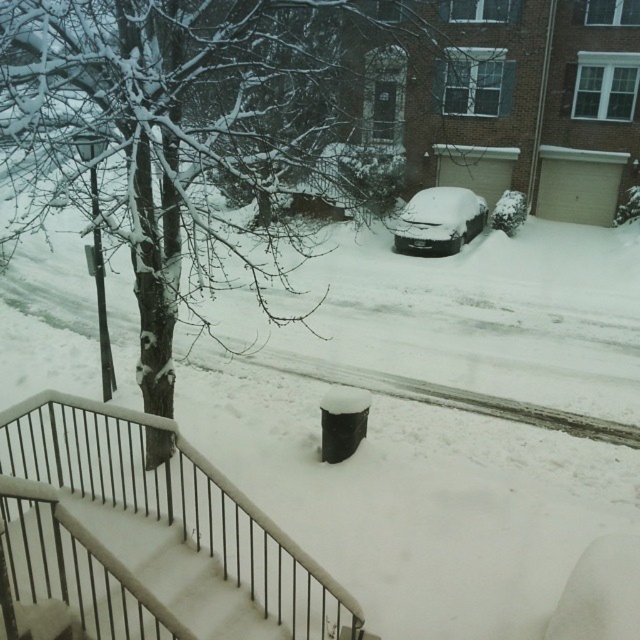
Who is shorter, snow-covered tree at center or snow-covered car at center?

snow-covered car at center

From the picture: Can you confirm if snow-covered tree at center is thinner than snow-covered car at center?

Incorrect, snow-covered tree at center's width is not less than snow-covered car at center's.

This screenshot has width=640, height=640. I want to click on snow-covered tree at center, so click(x=168, y=136).

This screenshot has width=640, height=640. What are the coordinates of `snow-covered tree at center` in the screenshot? It's located at (168, 136).

Is point (305, 45) closer to viewer compared to point (106, 593)?

No, it is not.

Who is lower down, snow-covered tree at center or metallic gray balustrade at lower center?

Positioned lower is metallic gray balustrade at lower center.

This screenshot has height=640, width=640. What are the coordinates of `snow-covered tree at center` in the screenshot? It's located at (168, 136).

Does metallic gray balustrade at lower center have a lesser height compared to snow-covered car at center?

Correct, metallic gray balustrade at lower center is not as tall as snow-covered car at center.

Looking at this image, does metallic gray balustrade at lower center lie behind snow-covered car at center?

No, metallic gray balustrade at lower center is in front of snow-covered car at center.

Between point (192, 483) and point (476, 230), which one is positioned behind?

The point (476, 230) is more distant.

Where is `metallic gray balustrade at lower center`? The width and height of the screenshot is (640, 640). metallic gray balustrade at lower center is located at coordinates (148, 532).